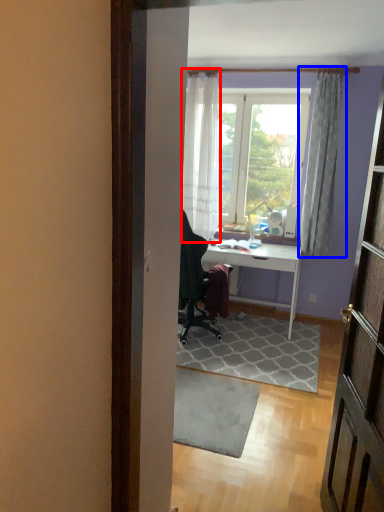
Question: Among these objects, which one is nearest to the camera, curtain (highlighted by a red box) or curtain (highlighted by a blue box)?

Choices:
 (A) curtain
 (B) curtain

Answer: (B)